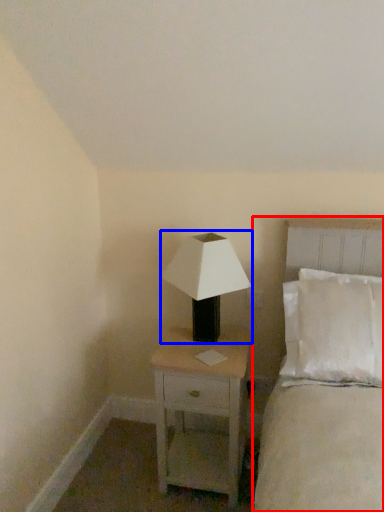
Question: Which of the following is the farthest to the observer, bed (highlighted by a red box) or lamp (highlighted by a blue box)?

Choices:
 (A) bed
 (B) lamp

Answer: (B)